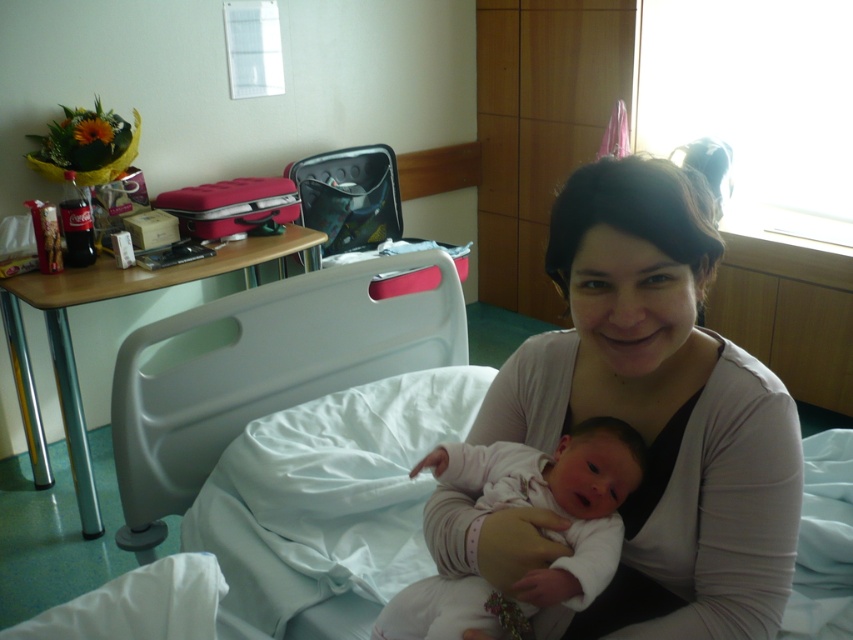
In the hospital room scene, you see a smooth white shirt at center and a light pink fabric newborn at center. Which object is wider?

The smooth white shirt at center is wider than the light pink fabric newborn at center.

Consider the image. In the hospital room scene, there is a woman sitting on a hospital bed holding a newborn baby. The scene also includes a small wooden table to the left of the bed with several items. You are asked to locate the exact position of the smooth white shirt at center. Which object from the following list is located at the coordinates point (660, 410)? The options are the smooth white shirt at center, the red suitcase on the table, the bottle of Coca Cola, the box of tissues, or the bouquet of flowers.

The point (660, 410) marks the smooth white shirt at center, so the correct answer is the smooth white shirt at center.

You are standing in the hospital room and want to reach the point at coordinates point [271,394]. If you can move 6 feet in one step, how many steps do you need to take to get there?

The point [271,394] is 5.45 feet from the viewer. Since you can move 6 feet in one step, you would need 1 step to reach it.